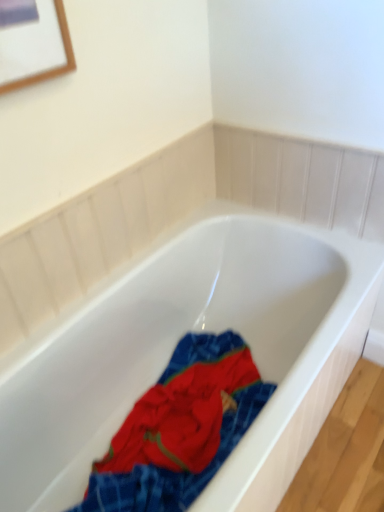
Question: Is white glossy bathtub at center far from textured cotton towel at center?

Choices:
 (A) yes
 (B) no

Answer: (B)

Question: Is white glossy bathtub at center positioned beyond the bounds of textured cotton towel at center?

Choices:
 (A) yes
 (B) no

Answer: (A)

Question: Is white glossy bathtub at center bigger than textured cotton towel at center?

Choices:
 (A) yes
 (B) no

Answer: (A)

Question: Is white glossy bathtub at center thinner than textured cotton towel at center?

Choices:
 (A) no
 (B) yes

Answer: (A)

Question: Is textured cotton towel at center completely or partially inside white glossy bathtub at center?

Choices:
 (A) no
 (B) yes

Answer: (B)

Question: Is white glossy bathtub at center looking in the opposite direction of textured cotton towel at center?

Choices:
 (A) yes
 (B) no

Answer: (A)

Question: Is textured cotton towel at center surrounding white glossy bathtub at center?

Choices:
 (A) yes
 (B) no

Answer: (B)

Question: Does textured cotton towel at center come in front of white glossy bathtub at center?

Choices:
 (A) no
 (B) yes

Answer: (A)

Question: Could you tell me if textured cotton towel at center is turned towards white glossy bathtub at center?

Choices:
 (A) yes
 (B) no

Answer: (A)

Question: From a real-world perspective, is textured cotton towel at center below white glossy bathtub at center?

Choices:
 (A) no
 (B) yes

Answer: (B)

Question: From the image's perspective, would you say textured cotton towel at center is shown under white glossy bathtub at center?

Choices:
 (A) no
 (B) yes

Answer: (B)

Question: Can we say textured cotton towel at center lies outside white glossy bathtub at center?

Choices:
 (A) no
 (B) yes

Answer: (A)

Question: In terms of height, does textured cotton towel at center look taller or shorter compared to white glossy bathtub at center?

Choices:
 (A) tall
 (B) short

Answer: (B)